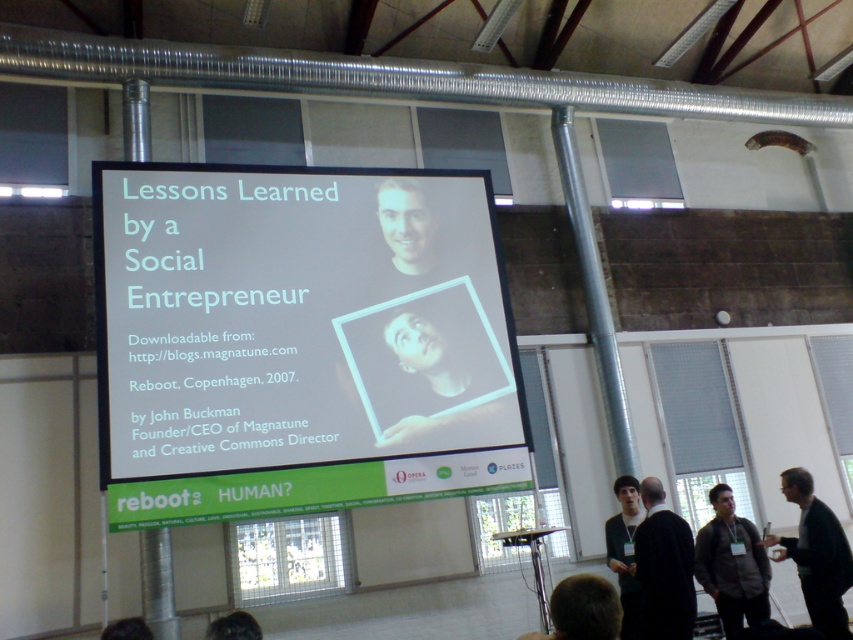
Question: Which object is farther from the camera taking this photo?

Choices:
 (A) black matte jacket at lower right
 (B) gray fabric shirt at lower right
 (C) white glossy projector screen at center
 (D) dark gray suit at lower right

Answer: (B)

Question: Which point is closer to the camera?

Choices:
 (A) dark brown hair at lower right
 (B) dark gray suit at lower right

Answer: (B)

Question: Can you confirm if white glossy projector screen at center is positioned above gray fabric shirt at lower right?

Choices:
 (A) yes
 (B) no

Answer: (A)

Question: Does dark gray suit at lower right have a smaller size compared to gray fabric shirt at lower right?

Choices:
 (A) no
 (B) yes

Answer: (B)

Question: Which of the following is the farthest from the observer?

Choices:
 (A) (633, 502)
 (B) (747, 604)
 (C) (688, 536)

Answer: (A)

Question: Does dark gray suit at lower right have a smaller size compared to gray fabric shirt at lower right?

Choices:
 (A) yes
 (B) no

Answer: (A)